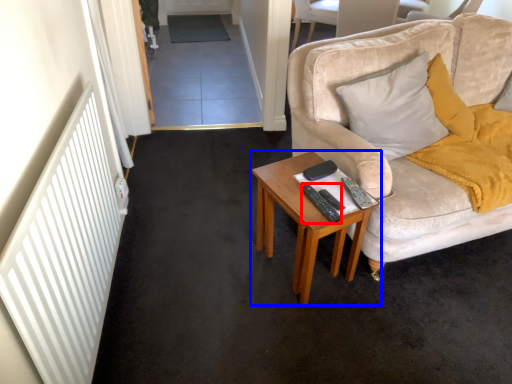
Question: Which point is closer to the camera, remote control (highlighted by a red box) or table (highlighted by a blue box)?

Choices:
 (A) remote control
 (B) table

Answer: (B)